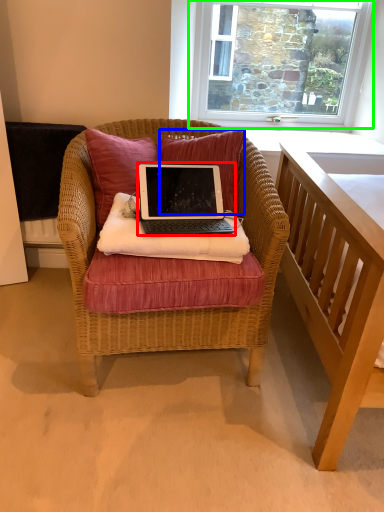
Question: Based on their relative distances, which object is farther from laptop (highlighted by a red box)? Choose from pillow (highlighted by a blue box) and window (highlighted by a green box).

Choices:
 (A) pillow
 (B) window

Answer: (B)